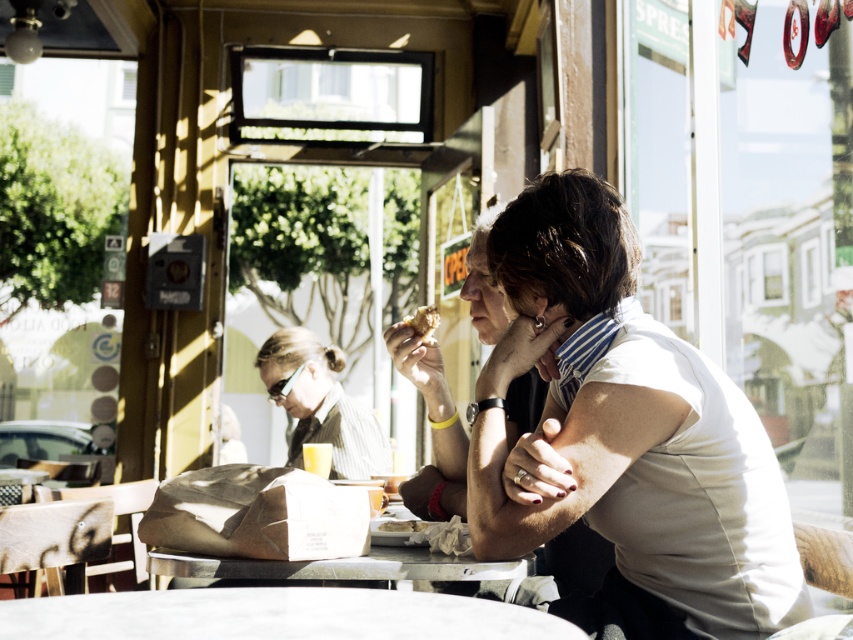
You are a photographer trying to capture a candid shot of the scene. You notice the white matte shirt at center and the white marble table at center. Which object should you focus on to ensure the other is also in the frame?

You should focus on the white marble table at center because the white matte shirt at center is to the right of it, so keeping the table centered would include the shirt in the frame.

From the picture: You are a photographer trying to capture a closeup shot of the matte black shirt at center and the matte black sunglasses at center. Which object should you zoom in on more to ensure both are in focus?

The matte black shirt at center is thinner than the matte black sunglasses at center, so you should zoom in more on the matte black sunglasses at center to ensure both are in focus.

You are a photographer trying to capture the reflection of the matte black sunglasses at center in the metallic reflective table at center. Based on the scene description, can you see the sunglasses reflected in the table?

The metallic reflective table at center is behind matte black sunglasses at center, so the sunglasses are not positioned in front of the table to be reflected. Therefore, the reflection would not be visible.